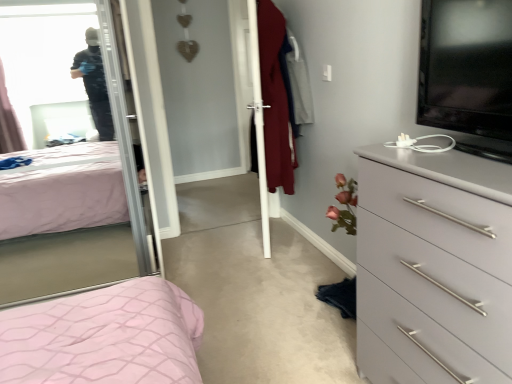
Question: Is black glossy tv at upper right taller or shorter than gray matte chest of drawers at right?

Choices:
 (A) tall
 (B) short

Answer: (B)

Question: From a real-world perspective, is black glossy tv at upper right physically located above or below gray matte chest of drawers at right?

Choices:
 (A) below
 (B) above

Answer: (B)

Question: Considering the real-world distances, which object is closest to the clear glass mirror at upper left?

Choices:
 (A) white glossy screen door at center
 (B) black glossy tv at upper right
 (C) gray matte chest of drawers at right

Answer: (C)

Question: Considering the real-world distances, which object is closest to the white glossy screen door at center?

Choices:
 (A) black glossy tv at upper right
 (B) clear glass mirror at upper left
 (C) gray matte chest of drawers at right

Answer: (B)